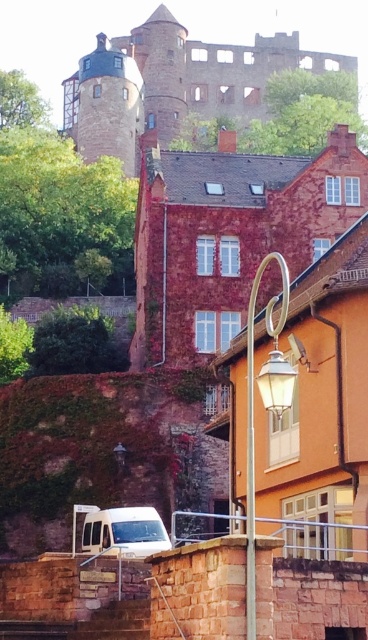
You are a photographer planning to capture a wide shot of the brown stone castle at upper center and the white matte van at lower left in the scene. Based on their positions and sizes, do you think both can fit within the same frame without cropping either object?

The brown stone castle at upper center might be wider than the white matte van at lower left, so it depends on the camera angle and distance. Ensure the camera is positioned far enough back to include both objects within the frame while maintaining their full visibility.

What are the coordinates of the brown stone castle at upper center in the image?

The coordinates of the brown stone castle at upper center are at point (x=172, y=84).